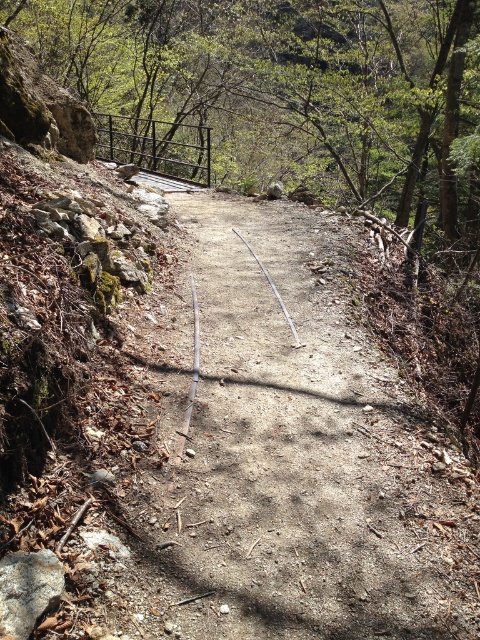
Question: Which of the following is the farthest from the observer?

Choices:
 (A) green leafy tree at center
 (B) gray rough rock at lower left

Answer: (A)

Question: Does green leafy tree at center appear on the right side of gray rough rock at lower left?

Choices:
 (A) yes
 (B) no

Answer: (A)

Question: Which object appears closest to the camera in this image?

Choices:
 (A) dirt path at center
 (B) green leafy tree at center
 (C) gray rough rock at lower left

Answer: (C)

Question: Which is farther from the dirt path at center?

Choices:
 (A) gray rough rock at lower left
 (B) green leafy tree at center

Answer: (B)

Question: Is the position of dirt path at center more distant than that of green leafy tree at center?

Choices:
 (A) no
 (B) yes

Answer: (A)

Question: Is dirt path at center to the left of green leafy tree at center from the viewer's perspective?

Choices:
 (A) yes
 (B) no

Answer: (A)